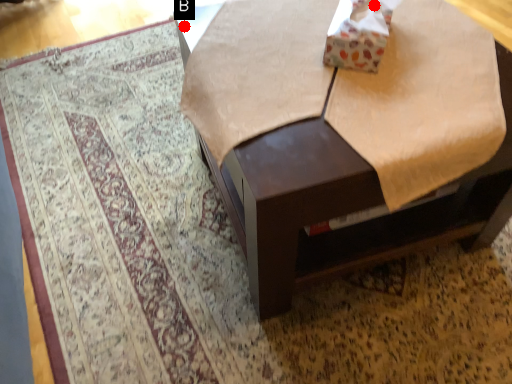
Question: Two points are circled on the image, labeled by A and B beside each circle. Which point appears closest to the camera in this image?

Choices:
 (A) A is closer
 (B) B is closer

Answer: (A)